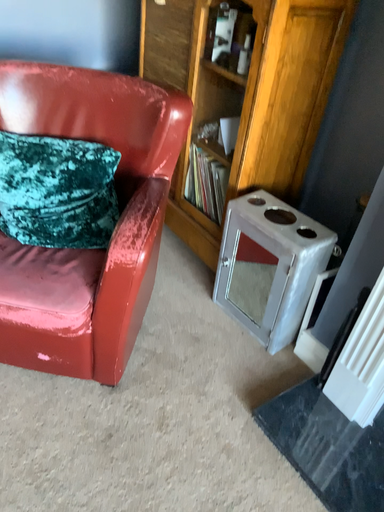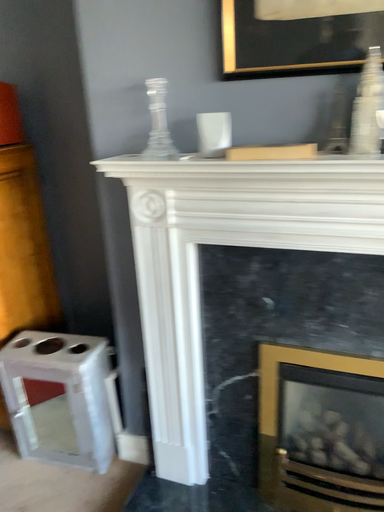
Question: How did the camera likely rotate when shooting the video?

Choices:
 (A) rotated downward
 (B) rotated upward

Answer: (B)